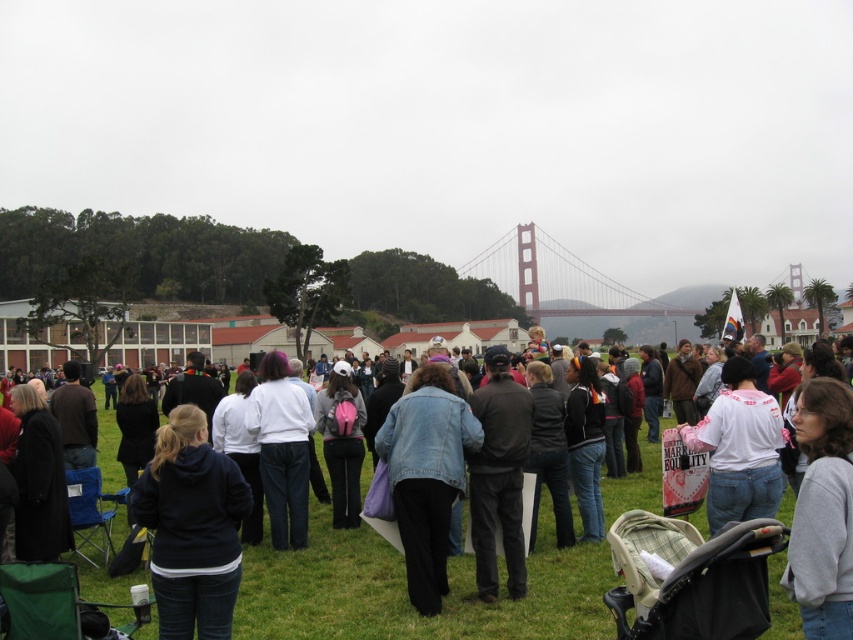
You are standing in the crowd at the event and want to take a photo of the green grass at center without any people blocking it. Since the black fleece jacket at lower left is between you and the grass, can you move around to get an unobstructed view?

The green grass at center is closer to the viewer than the black fleece jacket at lower left, so you can move to the side to get an unobstructed view of the grass by positioning yourself where the jacket is not blocking the line of sight.

You are part of the crowd at the event and want to move from your current position near the black fleece jacket at lower left to the green grass at center. Which direction should you move in?

You should move to the right to reach the green grass at center from the black fleece jacket at lower left since the green grass at center is located to the right of the black fleece jacket at lower left.

You are standing at the point labeled as point (405,593) in the image. What is the immediate surface you are standing on?

The immediate surface you are standing on is green grass at center.